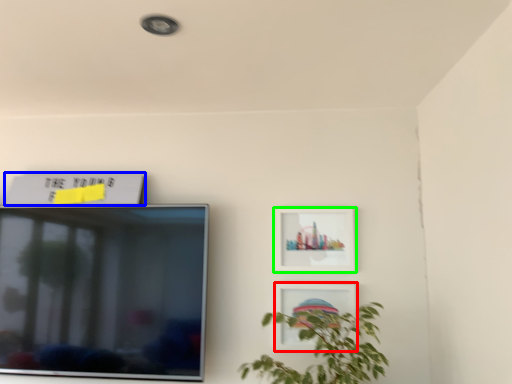
Question: Estimate the real-world distances between objects in this image. Which object is closer to picture frame (highlighted by a red box), picture frame (highlighted by a blue box) or picture frame (highlighted by a green box)?

Choices:
 (A) picture frame
 (B) picture frame

Answer: (B)